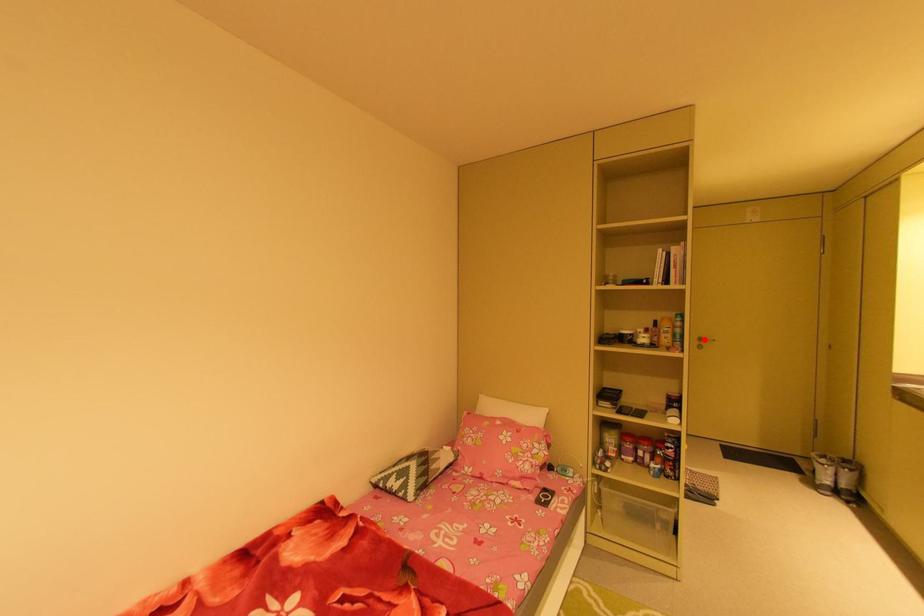
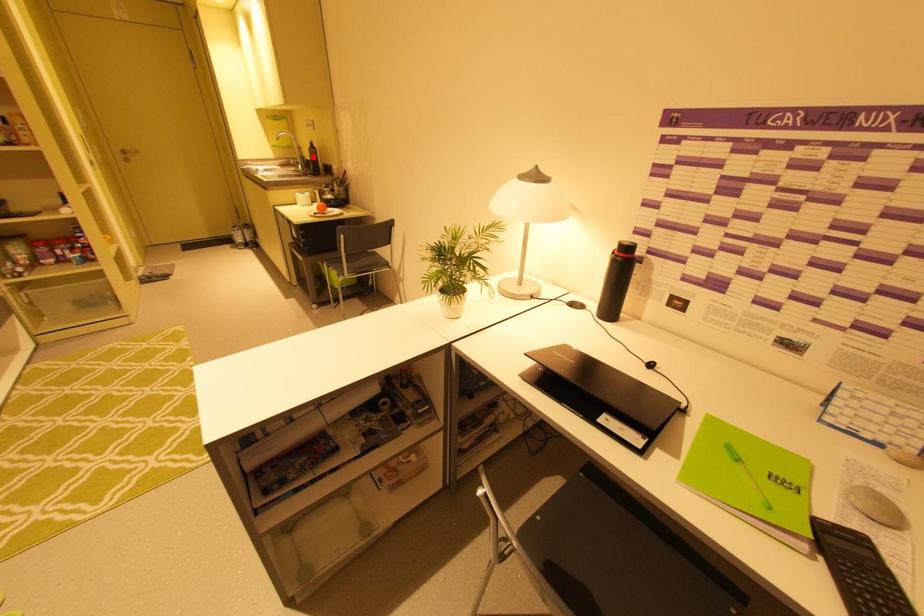
I am providing you with two images of the same scene from different viewpoints. A red point is marked on the first image and another point is marked on the second image. Does the point marked in image1 correspond to the same location as the one in image2?

No